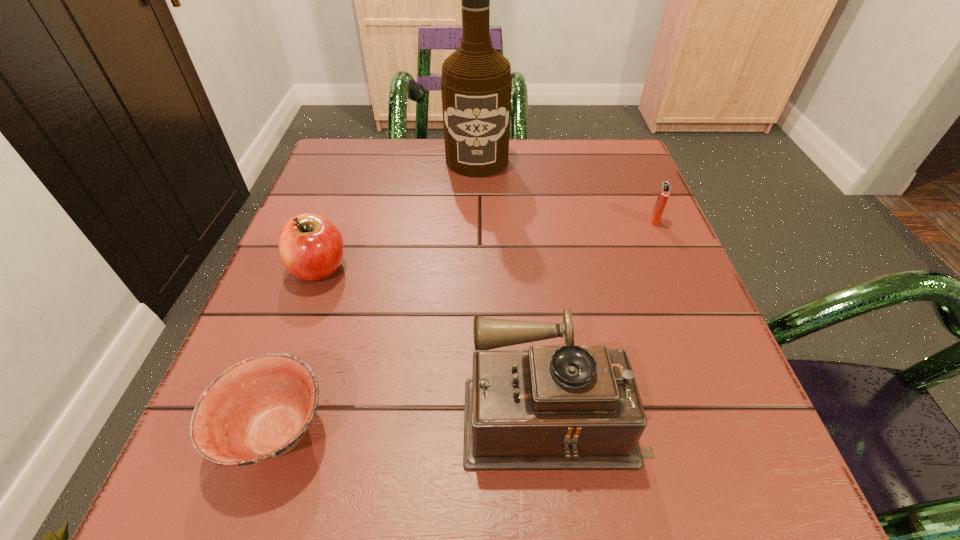
This screenshot has height=540, width=960. What are the coordinates of `free space located on the horn of the phonograph_record` in the screenshot? It's located at (416, 406).

At what (x,y) coordinates should I click in order to perform the action: click on free spot located 0.060m on the horn of the phonograph_record. Please return your answer as a coordinate pair (x, y). Image resolution: width=960 pixels, height=540 pixels. Looking at the image, I should click on (422, 406).

The width and height of the screenshot is (960, 540). Find the location of `free space located 0.140m on the front of the third nearest object`. free space located 0.140m on the front of the third nearest object is located at coordinates (286, 359).

Where is `vacant space located 0.210m on the left of the second farthest object`? vacant space located 0.210m on the left of the second farthest object is located at coordinates (550, 221).

The width and height of the screenshot is (960, 540). Find the location of `vacant region located 0.140m on the back of the bowl`. vacant region located 0.140m on the back of the bowl is located at coordinates (317, 311).

This screenshot has height=540, width=960. What are the coordinates of `object present at the far edge` in the screenshot? It's located at (476, 84).

You are a GUI agent. You are given a task and a screenshot of the screen. Output one action in this format:
    pyautogui.click(x=<x>, y=<y>)
    Task: Click on the phonograph_record situated at the near edge
    
    Given the screenshot: What is the action you would take?
    pyautogui.click(x=553, y=407)

Locate an element on the screen. The height and width of the screenshot is (540, 960). bowl at the near edge is located at coordinates (257, 410).

Locate an element on the screen. The image size is (960, 540). apple that is at the left edge is located at coordinates (311, 247).

Where is `bowl located in the left edge section of the desktop`? This screenshot has height=540, width=960. bowl located in the left edge section of the desktop is located at coordinates (257, 410).